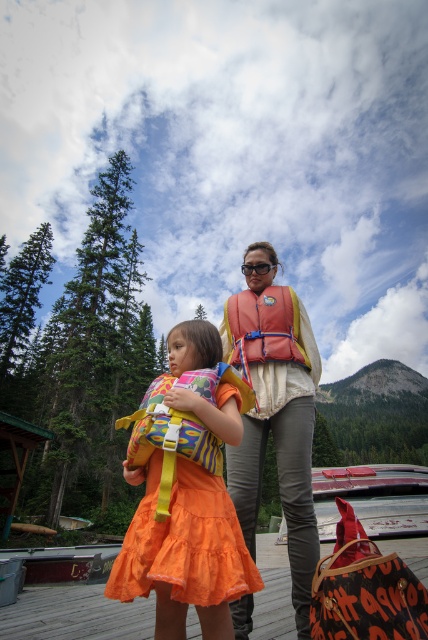
You are standing at the edge of the dock and want to reach a specific point marked at coordinates point (216, 529). If you can walk 8 feet in a straight line, will you be able to reach that point without stopping?

The distance of point (216, 529) from viewer is 7.57 feet, so yes, you can reach it since 7.57 feet is less than 8 feet.

You are a photographer planning to take a candid shot of the orange life vest at center and the leather textured bag at lower right. You want to ensure both items are in focus without moving the camera. What should you consider about their distance apart?

The orange life vest at center and the leather textured bag at lower right are 29.20 inches apart from each other. To keep both in focus, ensure the camera is focused on a point between them and use a small aperture for a larger depth of field.